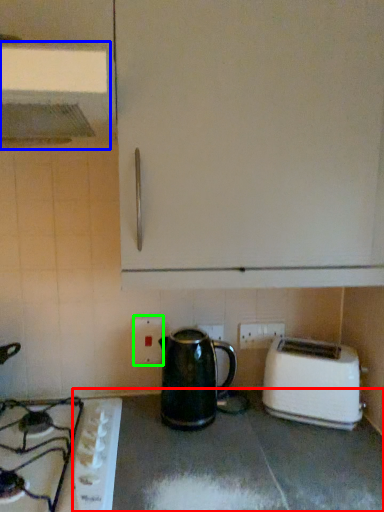
Question: Which object is the closest to the counter top (highlighted by a red box)? Choose among these: exhaust hood (highlighted by a blue box) or electric outlet (highlighted by a green box).

Choices:
 (A) exhaust hood
 (B) electric outlet

Answer: (B)